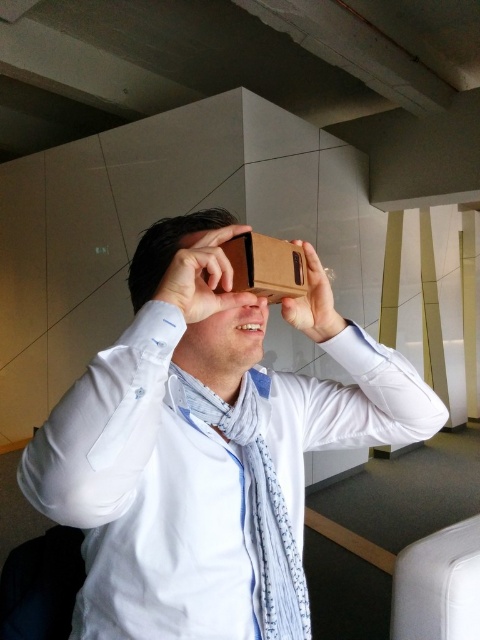
Consider the image. Is brown cardboard vr viewer at center positioned behind brown cardboard at center?

No.

Can you confirm if brown cardboard vr viewer at center is positioned to the left of brown cardboard at center?

Yes, brown cardboard vr viewer at center is to the left of brown cardboard at center.

Which is behind, point (288, 438) or point (247, 289)?

Point (288, 438)

Find the location of a particular element. brown cardboard vr viewer at center is located at coordinates (204, 451).

Between light blue textured scarf at center and brown cardboard at upper center, which one appears on the right side from the viewer's perspective?

brown cardboard at upper center is more to the right.

Who is higher up, light blue textured scarf at center or brown cardboard at upper center?

brown cardboard at upper center is higher up.

Does point (279, 512) lie behind point (327, 326)?

No, it is not.

This screenshot has width=480, height=640. Identify the location of light blue textured scarf at center. (257, 500).

Is point (136, 545) in front of point (240, 298)?

No, (136, 545) is further to viewer.

Between brown cardboard vr viewer at center and matte cardboard at center, which one has less height?

With less height is matte cardboard at center.

Is point (239, 504) positioned before point (184, 266)?

No, (239, 504) is behind (184, 266).

The image size is (480, 640). I want to click on brown cardboard vr viewer at center, so click(x=204, y=451).